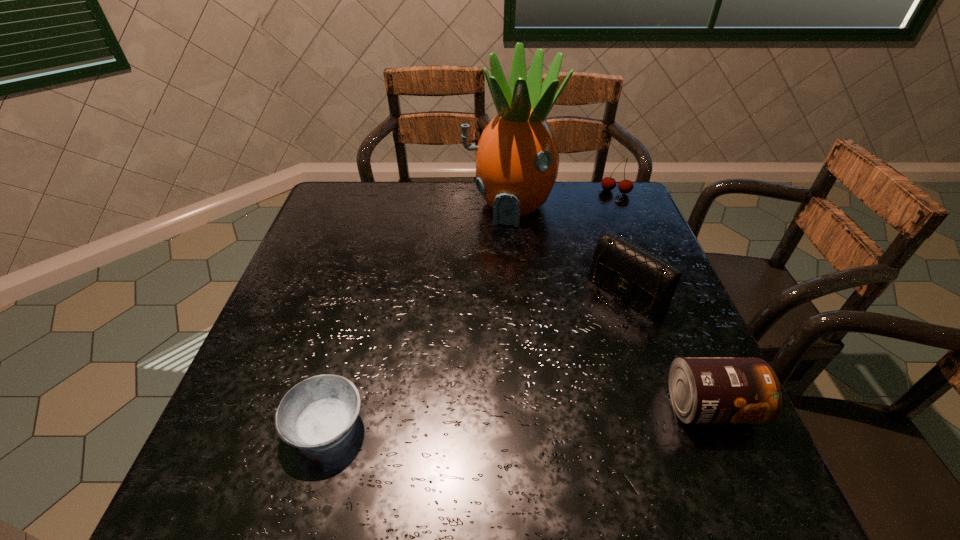
Identify which object is the second nearest to the clutch bag. Please provide its 2D coordinates. Your answer should be formatted as a tuple, i.e. [(x, y)], where the tuple contains the x and y coordinates of a point satisfying the conditions above.

[(517, 159)]

You are a GUI agent. You are given a task and a screenshot of the screen. Output one action in this format:
    pyautogui.click(x=<x>, y=<y>)
    Task: Click on the object that is the fourth closest to the leftmost object
    This screenshot has height=540, width=960.
    Given the screenshot: What is the action you would take?
    pyautogui.click(x=625, y=186)

The image size is (960, 540). Find the location of `free spot that satisfies the following two spatial constraints: 1. on the back side of the cherry; 2. on the right side of the clutch bag`. free spot that satisfies the following two spatial constraints: 1. on the back side of the cherry; 2. on the right side of the clutch bag is located at coordinates (592, 192).

This screenshot has height=540, width=960. Find the location of `vacant space that satisfies the following two spatial constraints: 1. on the back side of the ashtray; 2. on the right side of the cherry`. vacant space that satisfies the following two spatial constraints: 1. on the back side of the ashtray; 2. on the right side of the cherry is located at coordinates (391, 192).